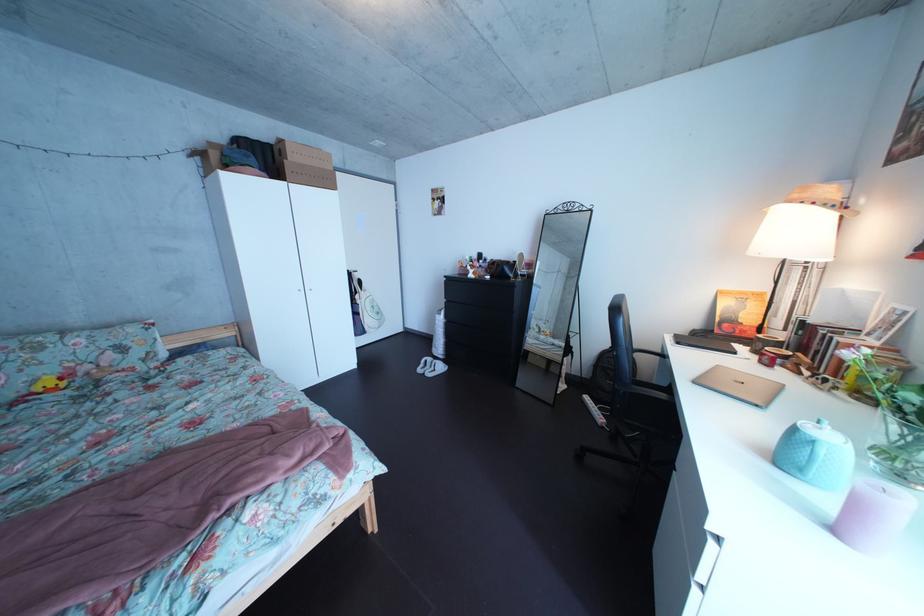
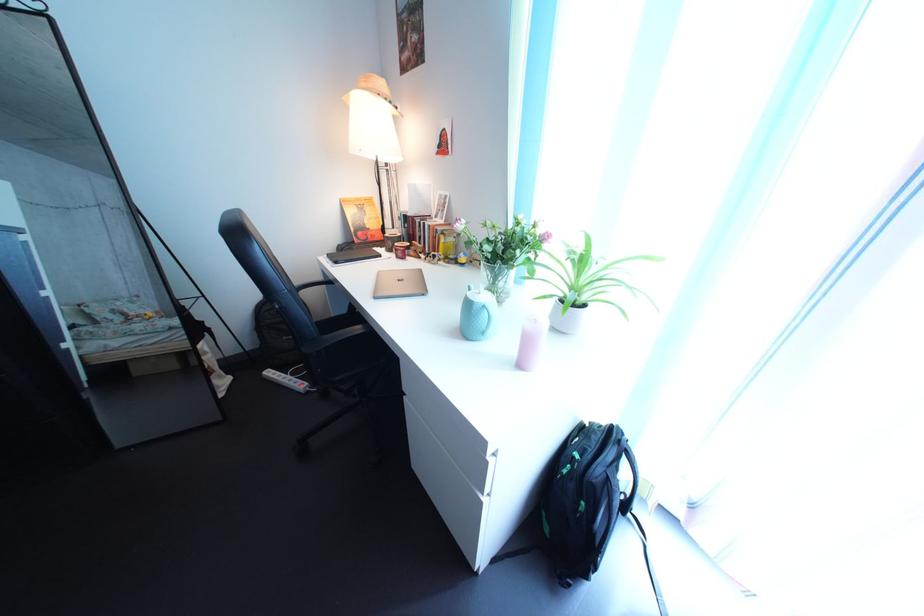
Find the pixel in the second image that matches (x=756, y=369) in the first image.

(402, 269)